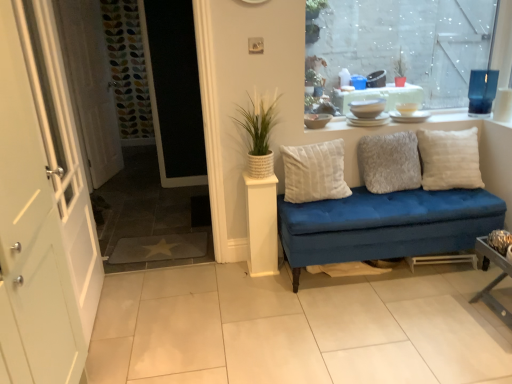
Question: Is transparent glass window at upper right to the right of white textured door at left from the viewer's perspective?

Choices:
 (A) yes
 (B) no

Answer: (A)

Question: Does transparent glass window at upper right come in front of white textured door at left?

Choices:
 (A) yes
 (B) no

Answer: (B)

Question: Is transparent glass window at upper right facing away from white textured door at left?

Choices:
 (A) yes
 (B) no

Answer: (B)

Question: Does transparent glass window at upper right have a lesser height compared to white textured door at left?

Choices:
 (A) no
 (B) yes

Answer: (B)

Question: Is transparent glass window at upper right smaller than white textured door at left?

Choices:
 (A) no
 (B) yes

Answer: (B)

Question: Considering the relative sizes of transparent glass window at upper right and white textured door at left in the image provided, is transparent glass window at upper right taller than white textured door at left?

Choices:
 (A) yes
 (B) no

Answer: (B)

Question: Are white soft cushion at right, marked as the first pillow in a right-to-left arrangement, and white matte pedestal at center, marked as the first table in a left-to-right arrangement, beside each other?

Choices:
 (A) no
 (B) yes

Answer: (A)

Question: Is white soft cushion at right, which appears as the third pillow when viewed from the left, positioned far away from white matte pedestal at center, placed as the second table when sorted from front to back?

Choices:
 (A) no
 (B) yes

Answer: (B)

Question: Can you confirm if white soft cushion at right, marked as the first pillow in a right-to-left arrangement, is shorter than white matte pedestal at center, placed as the second table when sorted from front to back?

Choices:
 (A) yes
 (B) no

Answer: (A)

Question: Can you confirm if white soft cushion at right, which appears as the third pillow when viewed from the left, is wider than white matte pedestal at center, marked as the first table in a left-to-right arrangement?

Choices:
 (A) yes
 (B) no

Answer: (A)

Question: Is white soft cushion at right, which appears as the third pillow when viewed from the left, located outside white matte pedestal at center, placed as the second table when sorted from front to back?

Choices:
 (A) yes
 (B) no

Answer: (A)

Question: Considering the relative sizes of white soft cushion at right, which appears as the third pillow when viewed from the left, and white matte pedestal at center, which is the 2th table in right-to-left order, in the image provided, is white soft cushion at right, which appears as the third pillow when viewed from the left, smaller than white matte pedestal at center, which is the 2th table in right-to-left order,?

Choices:
 (A) no
 (B) yes

Answer: (A)

Question: Is white tile at center wider than white soft cushion at right, which appears as the third pillow when viewed from the left?

Choices:
 (A) yes
 (B) no

Answer: (A)